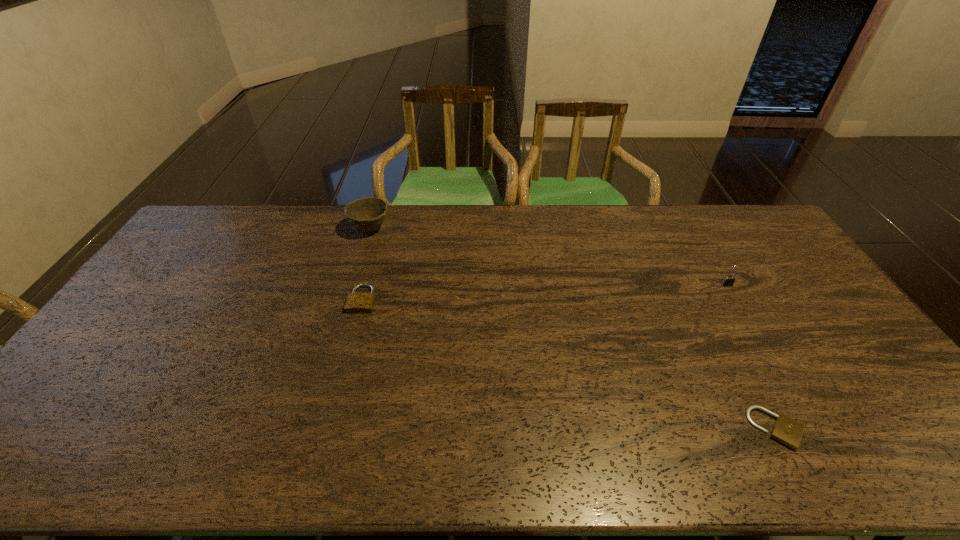
Where is `empty space between the rightmost object and the second padlock from left to right`? The image size is (960, 540). empty space between the rightmost object and the second padlock from left to right is located at coordinates (752, 356).

This screenshot has width=960, height=540. Identify the location of blank region between the shortest padlock and the rightmost padlock. (752, 356).

Find the location of a particular element. This screenshot has height=540, width=960. vacant space that's between the shortest padlock and the second shortest padlock is located at coordinates (569, 364).

The image size is (960, 540). I want to click on vacant space that is in between the tallest object and the second shortest object, so click(x=367, y=265).

This screenshot has height=540, width=960. Identify the location of free area in between the third shortest object and the second tallest padlock. (544, 292).

Find the location of `vacant area between the tallest padlock and the second tallest padlock`. vacant area between the tallest padlock and the second tallest padlock is located at coordinates (544, 292).

Where is `vacant space in between the leftmost padlock and the nearest padlock`? vacant space in between the leftmost padlock and the nearest padlock is located at coordinates (569, 364).

This screenshot has width=960, height=540. In order to click on empty location between the rightmost padlock and the farthest object in this screenshot , I will do `click(548, 257)`.

Where is `vacant area between the second object from right to left and the bowl`? The height and width of the screenshot is (540, 960). vacant area between the second object from right to left and the bowl is located at coordinates (573, 329).

Locate an element on the screen. the second closest object to the second tallest padlock is located at coordinates (787, 431).